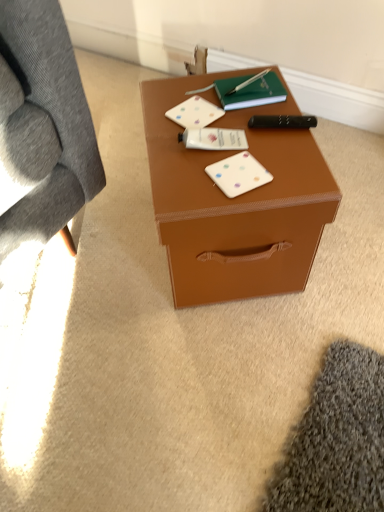
Find the location of `vacant region to the right of brown matte box at center`. vacant region to the right of brown matte box at center is located at coordinates (349, 232).